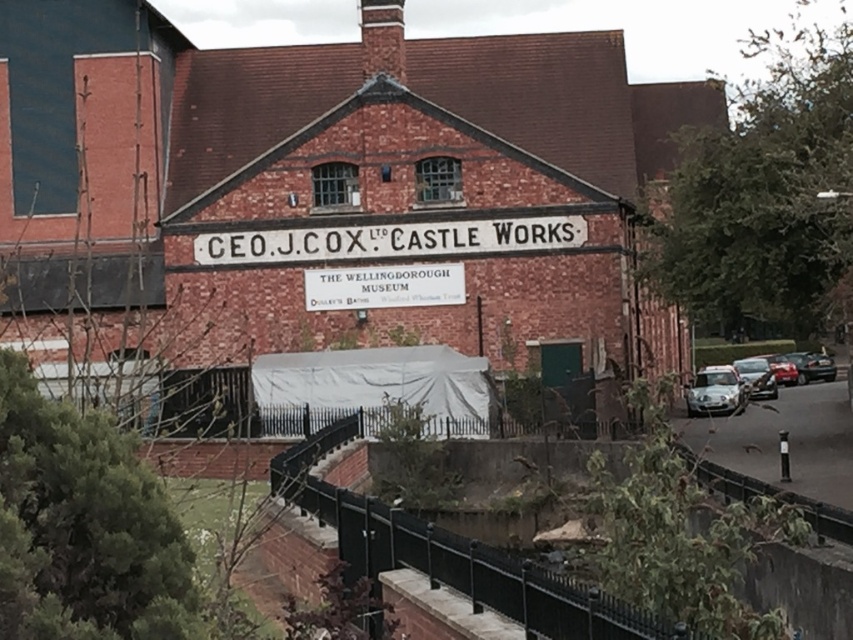
Who is positioned more to the left, white paper sign at center or shiny silver car at right?

Positioned to the left is white paper sign at center.

The width and height of the screenshot is (853, 640). What are the coordinates of `white paper sign at center` in the screenshot? It's located at (383, 285).

Is white painted wood sign at center wider than metallic silver car at right?

Correct, the width of white painted wood sign at center exceeds that of metallic silver car at right.

Can you confirm if white painted wood sign at center is positioned below metallic silver car at right?

Actually, white painted wood sign at center is above metallic silver car at right.

Is point (299, 243) closer to viewer compared to point (733, 358)?

Yes.

Where is `white painted wood sign at center`? This screenshot has width=853, height=640. white painted wood sign at center is located at coordinates (390, 241).

Can you confirm if white painted wood sign at center is thinner than white paper sign at center?

No, white painted wood sign at center is not thinner than white paper sign at center.

Image resolution: width=853 pixels, height=640 pixels. Describe the element at coordinates (390, 241) in the screenshot. I see `white painted wood sign at center` at that location.

This screenshot has width=853, height=640. Identify the location of white painted wood sign at center. (390, 241).